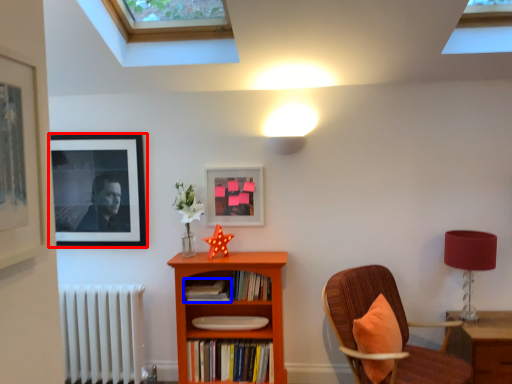
Question: Which object is further to the camera taking this photo, picture frame (highlighted by a red box) or book (highlighted by a blue box)?

Choices:
 (A) picture frame
 (B) book

Answer: (A)